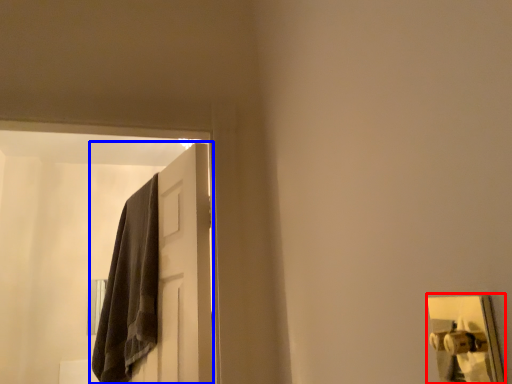
Question: Which of the following is the farthest to the observer, door handle (highlighted by a red box) or door (highlighted by a blue box)?

Choices:
 (A) door handle
 (B) door

Answer: (B)